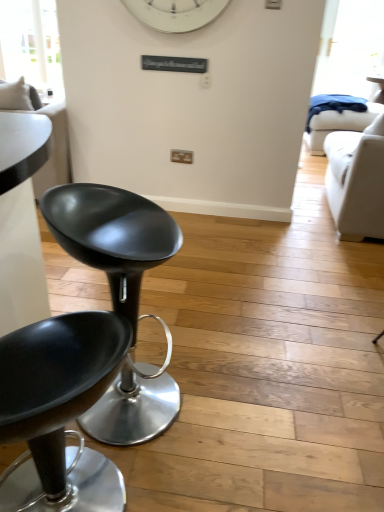
Question: From a real-world perspective, is white fabric couch at left positioned under transparent glass window at upper left based on gravity?

Choices:
 (A) no
 (B) yes

Answer: (B)

Question: Is white fabric couch at left smaller than transparent glass window at upper left?

Choices:
 (A) no
 (B) yes

Answer: (A)

Question: From the image's perspective, does white fabric couch at left appear higher than transparent glass window at upper left?

Choices:
 (A) no
 (B) yes

Answer: (A)

Question: Is white fabric couch at left taller than transparent glass window at upper left?

Choices:
 (A) no
 (B) yes

Answer: (A)

Question: From a real-world perspective, is white fabric couch at left over transparent glass window at upper left?

Choices:
 (A) yes
 (B) no

Answer: (B)

Question: Is there a large distance between white fabric couch at left and transparent glass window at upper left?

Choices:
 (A) no
 (B) yes

Answer: (B)

Question: Does matte black stool at left, positioned as the first chair in front-to-back order, have a lesser height compared to white leather couch at right?

Choices:
 (A) no
 (B) yes

Answer: (B)

Question: Is matte black stool at left, positioned as the first chair in front-to-back order, not close to white leather couch at right?

Choices:
 (A) no
 (B) yes

Answer: (B)

Question: Is matte black stool at left, acting as the 2th chair starting from the back, touching white leather couch at right?

Choices:
 (A) no
 (B) yes

Answer: (A)

Question: From the image's perspective, is matte black stool at left, positioned as the first chair in front-to-back order, located above white leather couch at right?

Choices:
 (A) yes
 (B) no

Answer: (B)

Question: Is matte black stool at left, acting as the 2th chair starting from the back, aimed at white leather couch at right?

Choices:
 (A) no
 (B) yes

Answer: (A)

Question: From a real-world perspective, is matte black stool at left, positioned as the first chair in front-to-back order, on top of white leather couch at right?

Choices:
 (A) no
 (B) yes

Answer: (A)

Question: Does matte black stool at left, acting as the 2th chair starting from the back, lie in front of white fabric couch at left?

Choices:
 (A) no
 (B) yes

Answer: (B)